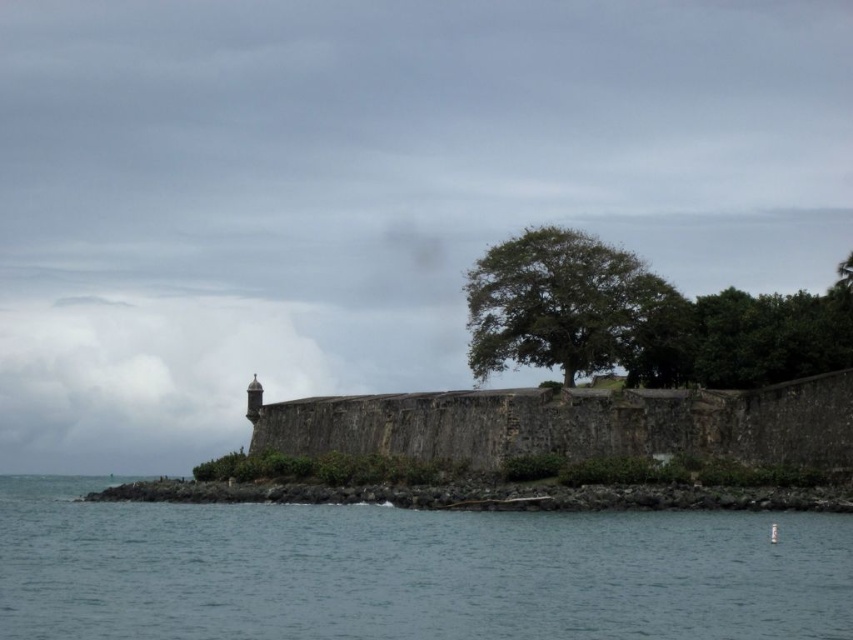
Question: Which point is farther to the camera?

Choices:
 (A) dark stone wall at lower left
 (B) blue water at lower left
 (C) weathered stone fort at center

Answer: (C)

Question: Is weathered stone fort at center bigger than green leafy tree at upper right?

Choices:
 (A) yes
 (B) no

Answer: (B)

Question: Which point is closer to the camera taking this photo?

Choices:
 (A) (416, 513)
 (B) (467, 493)
 (C) (788, 412)

Answer: (B)

Question: Among these objects, which one is nearest to the camera?

Choices:
 (A) weathered stone fort at center
 (B) green leafy tree at center
 (C) dark stone wall at lower left

Answer: (C)

Question: Can you confirm if blue water at lower left is positioned to the left of weathered stone fort at center?

Choices:
 (A) no
 (B) yes

Answer: (B)

Question: Observing the image, what is the correct spatial positioning of green leafy tree at center in reference to dark stone wall at lower left?

Choices:
 (A) below
 (B) above

Answer: (B)